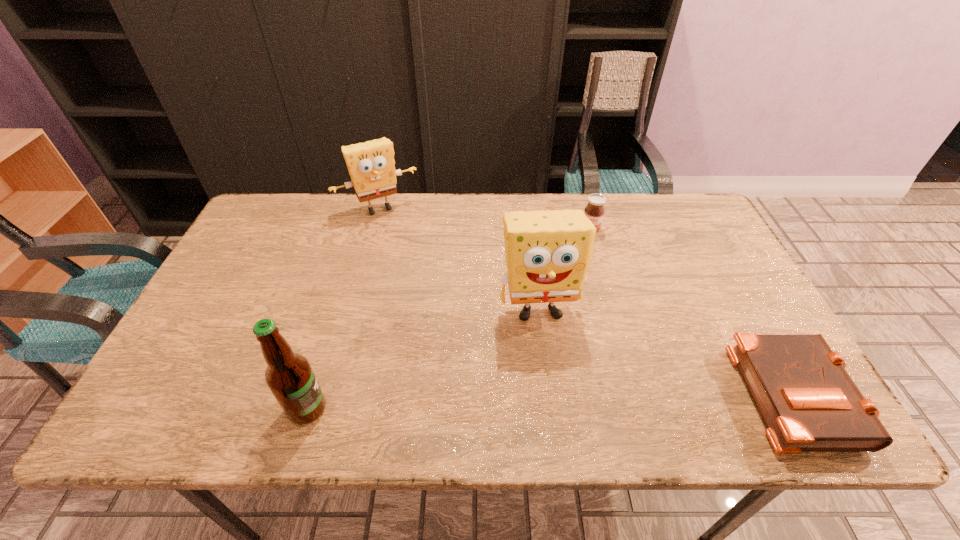
In order to click on vacant space that is in between the rightmost object and the third nearest object in this screenshot , I will do `click(666, 351)`.

Locate an element on the screen. The image size is (960, 540). blank region between the right sponge and the shorter sponge is located at coordinates (460, 259).

This screenshot has height=540, width=960. What are the coordinates of `free space between the farthest object and the Bible` in the screenshot? It's located at pyautogui.click(x=586, y=300).

Where is `vacant space that's between the Bible and the third nearest object`? vacant space that's between the Bible and the third nearest object is located at coordinates (666, 351).

This screenshot has width=960, height=540. What are the coordinates of `blank region between the Bible and the beer bottle` in the screenshot? It's located at (550, 401).

The image size is (960, 540). I want to click on free space that is in between the second object from right to left and the Bible, so click(691, 310).

I want to click on empty space between the fourth object from left to right and the third shortest object, so click(485, 218).

You are a GUI agent. You are given a task and a screenshot of the screen. Output one action in this format:
    pyautogui.click(x=<x>, y=<y>)
    Task: Click on the free space between the Bible and the beer bottle
    This screenshot has height=540, width=960.
    Given the screenshot: What is the action you would take?
    pyautogui.click(x=550, y=401)

Image resolution: width=960 pixels, height=540 pixels. Identify the location of object that is the fourth closest to the beer bottle. (809, 403).

The image size is (960, 540). What are the coordinates of `the second closest object to the rightmost object` in the screenshot? It's located at (594, 210).